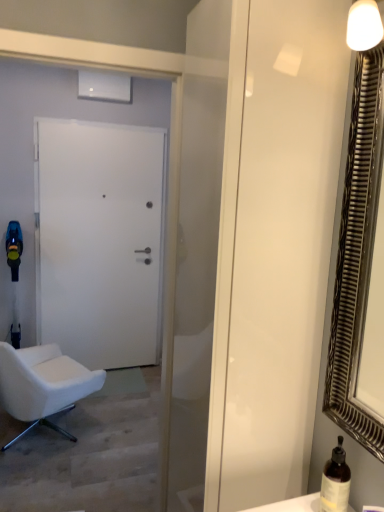
Question: From the image's perspective, is metallic silver mirror at right positioned above or below white matte door at center?

Choices:
 (A) above
 (B) below

Answer: (A)

Question: In terms of height, does metallic silver mirror at right look taller or shorter compared to white matte door at center?

Choices:
 (A) short
 (B) tall

Answer: (A)

Question: Estimate the real-world distances between objects in this image. Which object is farther from the brown glass bottle at lower right?

Choices:
 (A) transparent glass screen door at center
 (B) white matte door at center
 (C) metallic silver mirror at right
 (D) white fabric chair at left

Answer: (B)

Question: Estimate the real-world distances between objects in this image. Which object is closer to the white matte door at center?

Choices:
 (A) metallic silver mirror at right
 (B) brown glass bottle at lower right
 (C) white fabric chair at left
 (D) transparent glass screen door at center

Answer: (C)